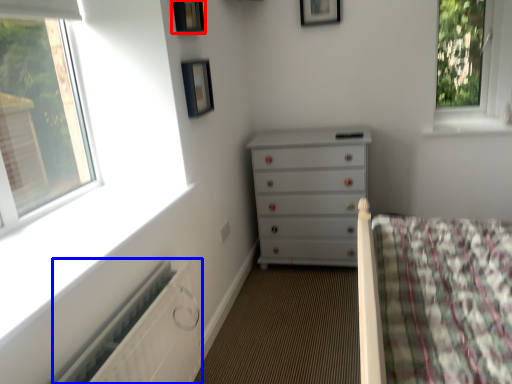
Question: Which of the following is the farthest to the observer, picture frame (highlighted by a red box) or radiator (highlighted by a blue box)?

Choices:
 (A) picture frame
 (B) radiator

Answer: (A)